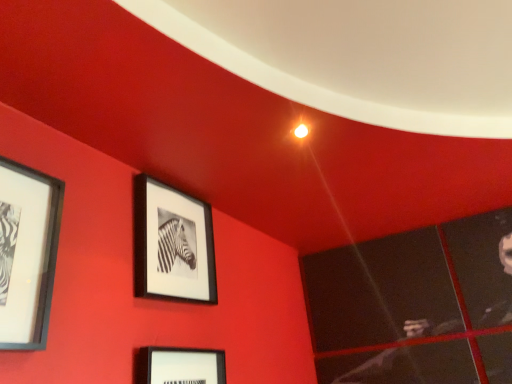
Question: Can you confirm if matte black picture frame at center, the first picture frame in the right-to-left sequence, is shorter than matte black picture frame at left, which ranks as the 1th picture frame in left-to-right order?

Choices:
 (A) no
 (B) yes

Answer: (A)

Question: Is matte black picture frame at center, the second picture frame viewed from the front, wider than matte black picture frame at left, which ranks as the 1th picture frame in left-to-right order?

Choices:
 (A) yes
 (B) no

Answer: (B)

Question: Is matte black picture frame at center, the second picture frame viewed from the front, facing away from matte black picture frame at left, positioned as the first picture frame in front-to-back order?

Choices:
 (A) no
 (B) yes

Answer: (A)

Question: Is matte black picture frame at center, the second picture frame viewed from the front, located outside matte black picture frame at left, positioned as the first picture frame in front-to-back order?

Choices:
 (A) yes
 (B) no

Answer: (A)

Question: Could you tell me if matte black picture frame at center, the second picture frame positioned from the left, is turned towards matte black picture frame at left, acting as the 2th picture frame starting from the back?

Choices:
 (A) no
 (B) yes

Answer: (A)

Question: Is matte black picture frame at center, the second picture frame viewed from the front, not near matte black picture frame at left, which ranks as the 1th picture frame in left-to-right order?

Choices:
 (A) yes
 (B) no

Answer: (B)

Question: Can you confirm if matte black picture frame at left, which ranks as the 1th picture frame in left-to-right order, is taller than matte black picture frame at center, the first picture frame viewed from the back?

Choices:
 (A) no
 (B) yes

Answer: (A)

Question: From a real-world perspective, is matte black picture frame at left, positioned as the first picture frame in front-to-back order, beneath matte black picture frame at center, the second picture frame positioned from the left?

Choices:
 (A) yes
 (B) no

Answer: (A)

Question: Is matte black picture frame at left, positioned as the first picture frame in front-to-back order, not close to matte black picture frame at center, the first picture frame viewed from the back?

Choices:
 (A) yes
 (B) no

Answer: (B)

Question: Does matte black picture frame at left, which ranks as the 1th picture frame in left-to-right order, have a smaller size compared to matte black picture frame at center, the second picture frame viewed from the front?

Choices:
 (A) no
 (B) yes

Answer: (B)

Question: Is matte black picture frame at left, acting as the 2th picture frame starting from the back, closer to camera compared to matte black picture frame at center, the second picture frame viewed from the front?

Choices:
 (A) yes
 (B) no

Answer: (A)

Question: Does matte black picture frame at left, the 2th picture frame when ordered from right to left, have a larger size compared to matte black picture frame at center, the second picture frame viewed from the front?

Choices:
 (A) no
 (B) yes

Answer: (A)

Question: Relative to matte black picture frame at left, acting as the 2th picture frame starting from the back, is matte black picture frame at center, the second picture frame positioned from the left, in front or behind?

Choices:
 (A) behind
 (B) front

Answer: (A)